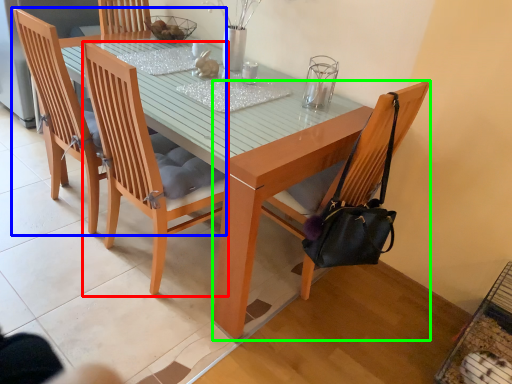
Question: Which object is positioned closest to chair (highlighted by a red box)? Select from chair (highlighted by a blue box) and chair (highlighted by a green box).

Choices:
 (A) chair
 (B) chair

Answer: (A)